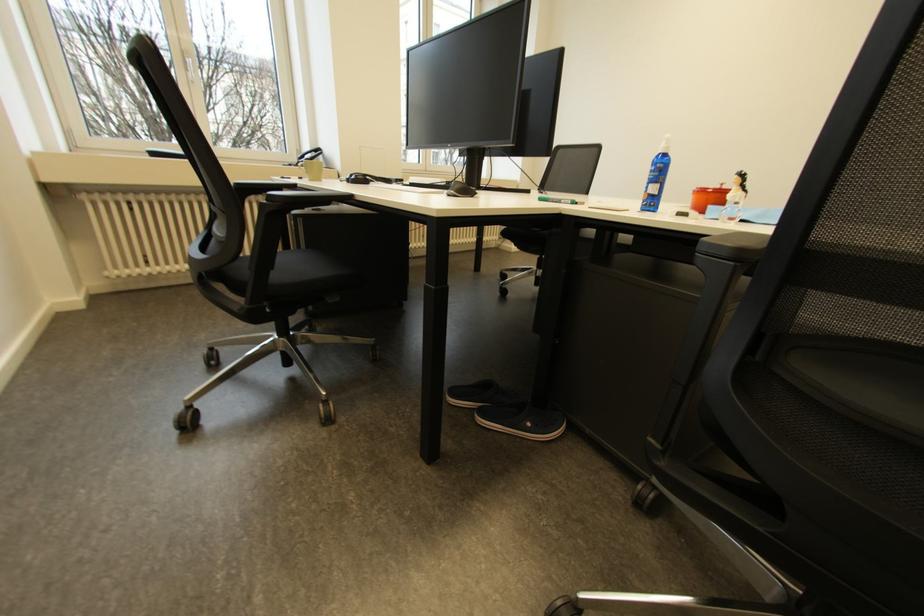
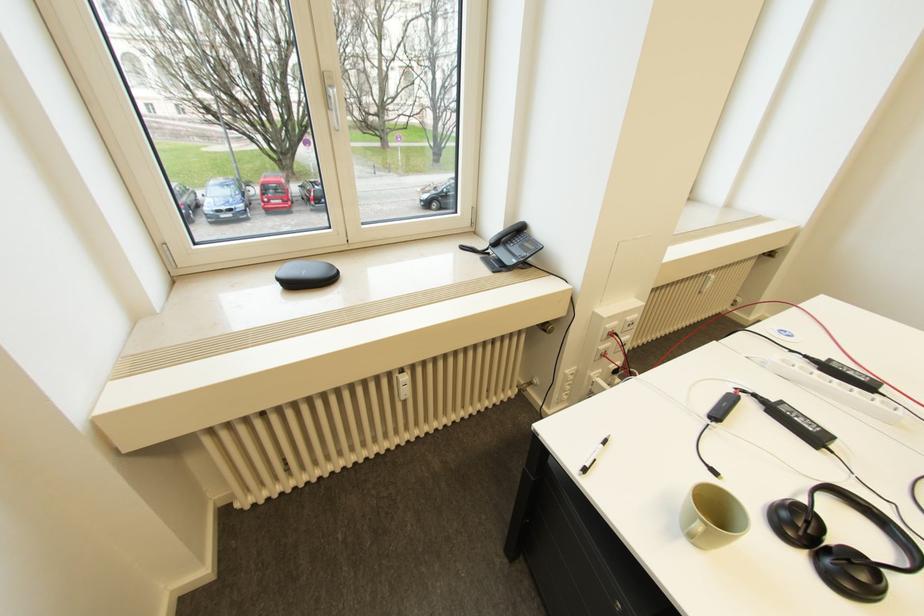
Where in the second image is the point corresponding to pixel 195 63 from the first image?

(335, 98)